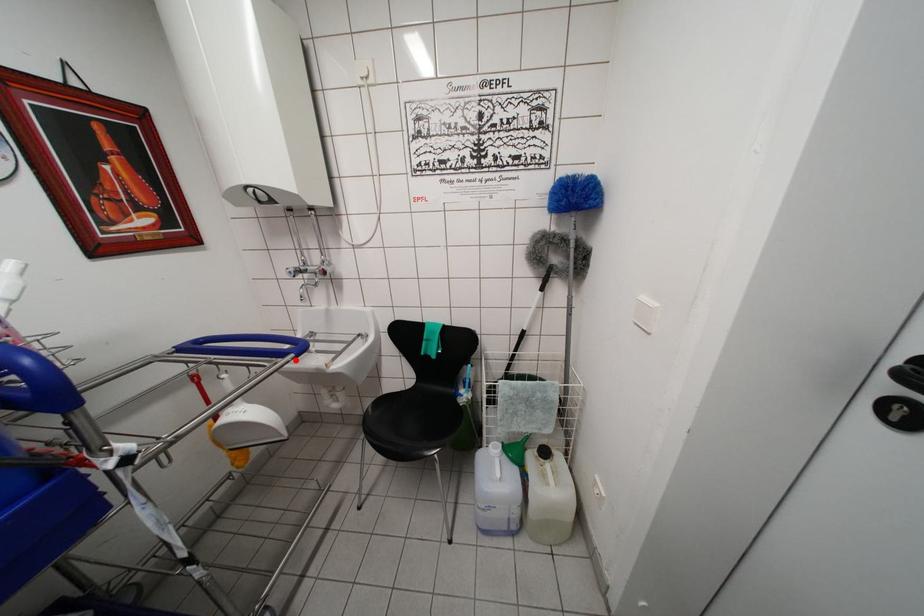
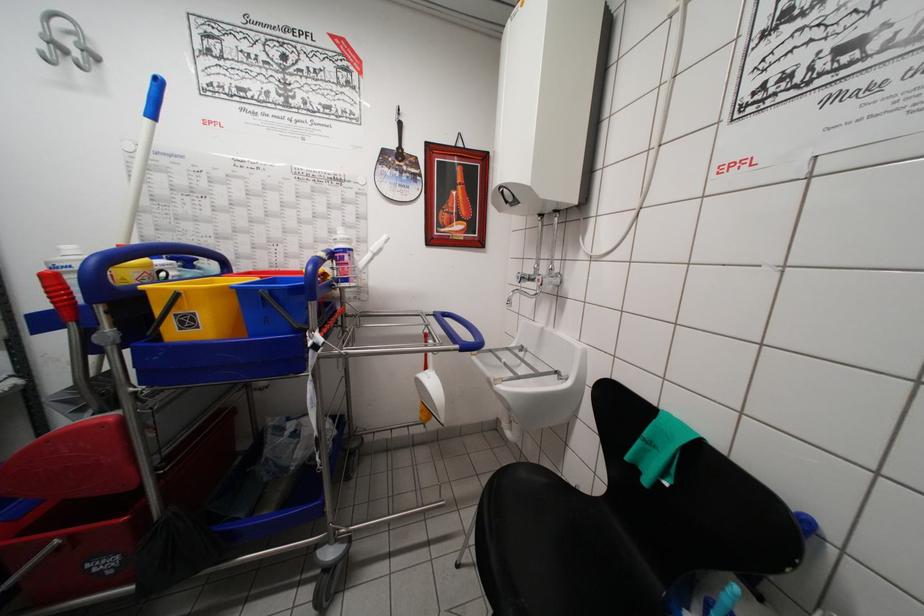
Question: A red point is marked in image1. In image2, is the corresponding 3D point closer to the camera or farther? Reply with the corresponding letter.

Choices:
 (A) The corresponding 3D point is closer.
 (B) The corresponding 3D point is farther.

Answer: (B)